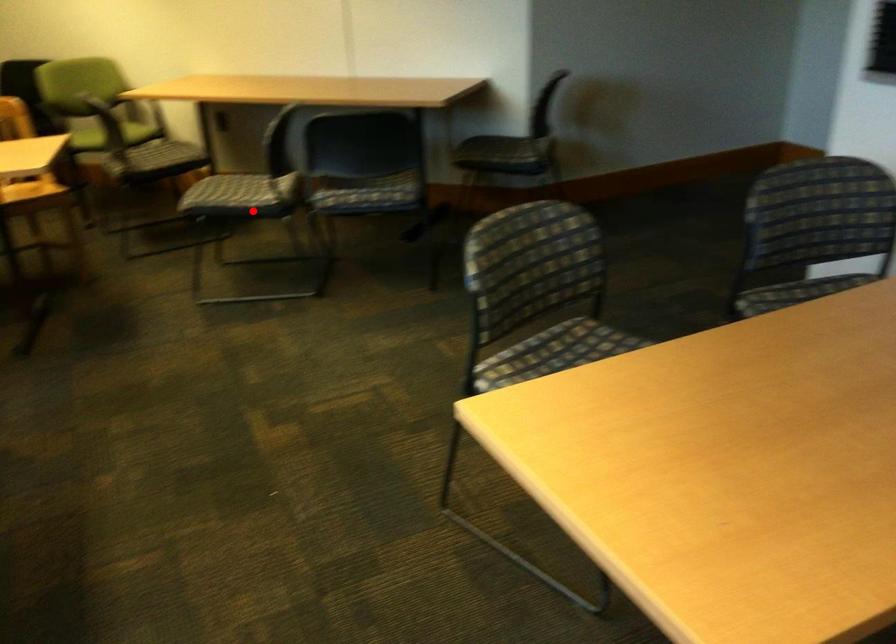
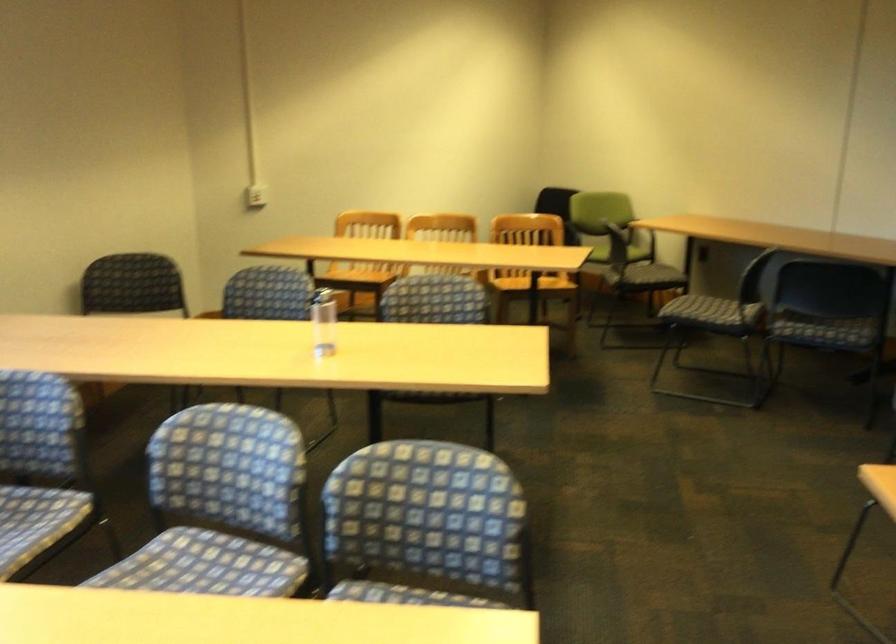
The point at the highlighted location is marked in the first image. Where is the corresponding point in the second image?

(721, 316)